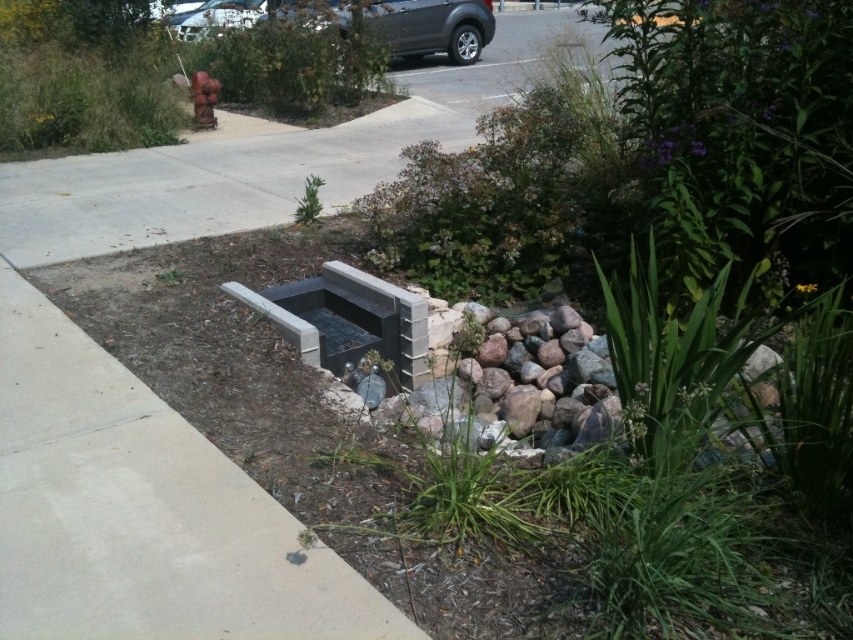
Question: Considering the real-world distances, which object is farthest from the concrete at center?

Choices:
 (A) metallic silver car at upper center
 (B) gray concrete fire pit at center
 (C) gray concrete bench at lower center
 (D) dark gray metallic car at upper center

Answer: (A)

Question: Among these objects, which one is farthest from the camera?

Choices:
 (A) gray concrete fire pit at center
 (B) metallic silver car at upper center
 (C) dark gray metallic car at upper center

Answer: (B)

Question: Does gray concrete fire pit at center appear on the left side of rusty metal hydrant at upper center?

Choices:
 (A) no
 (B) yes

Answer: (A)

Question: Which is farther from the metallic silver car at upper center?

Choices:
 (A) rusty metal hydrant at upper center
 (B) dark gray metallic car at upper center
 (C) concrete at center
 (D) gray concrete bench at lower center

Answer: (D)

Question: Does concrete at center come in front of dark gray metallic car at upper center?

Choices:
 (A) yes
 (B) no

Answer: (A)

Question: Considering the relative positions of dark gray metallic car at upper center and metallic silver car at upper center in the image provided, where is dark gray metallic car at upper center located with respect to metallic silver car at upper center?

Choices:
 (A) left
 (B) right

Answer: (B)